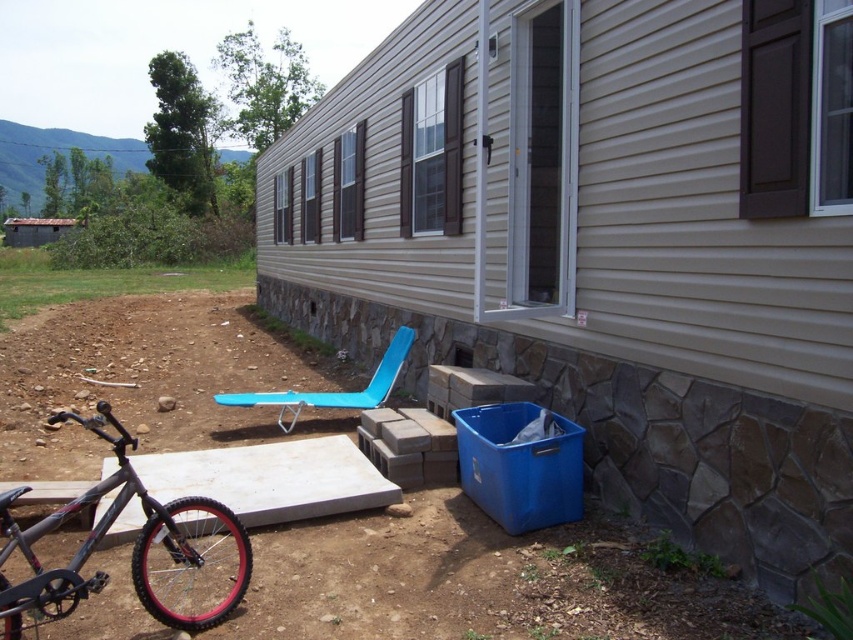
Who is lower down, shiny black frame at lower left or blue plastic beach chair at lower center?

shiny black frame at lower left is lower down.

I want to click on shiny black frame at lower left, so click(132, 548).